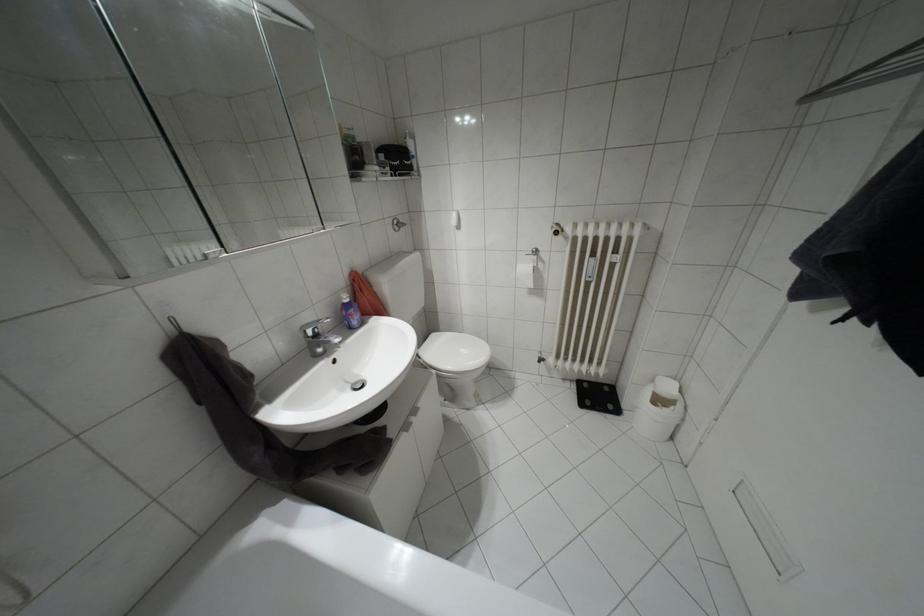
Find the location of a particular element. The height and width of the screenshot is (616, 924). mirror cabinet door is located at coordinates (207, 251).